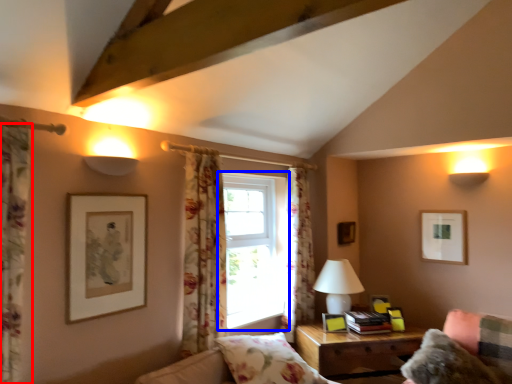
Question: Which of the following is the farthest to the observer, curtain (highlighted by a red box) or window (highlighted by a blue box)?

Choices:
 (A) curtain
 (B) window

Answer: (B)